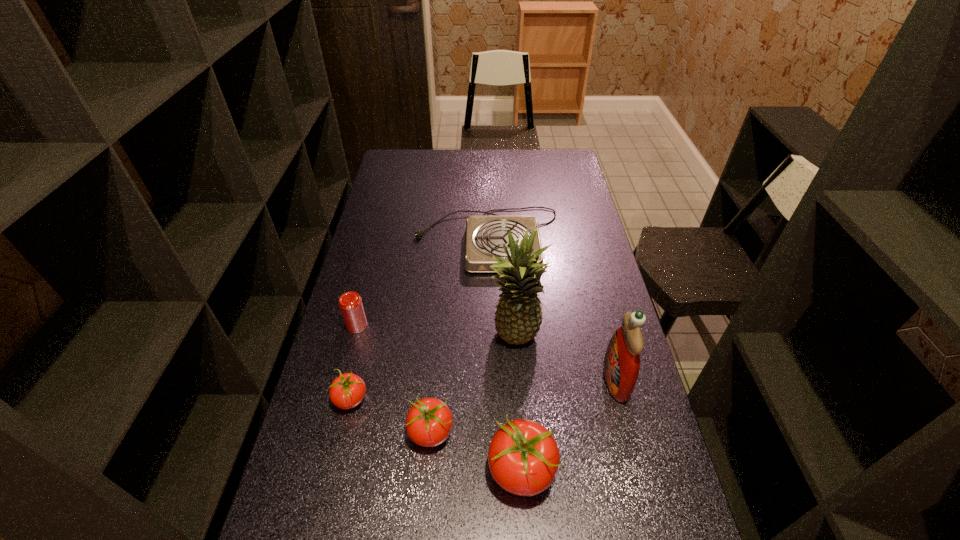
The height and width of the screenshot is (540, 960). In order to click on beer can in this screenshot , I will do `click(350, 303)`.

Identify the location of free space located on the right of the leftmost tomato. This screenshot has width=960, height=540. (486, 399).

Find the location of a particular element. free space located 0.170m on the left of the second tallest tomato is located at coordinates (342, 434).

The height and width of the screenshot is (540, 960). I want to click on free spot located on the left of the third tallest object, so click(372, 472).

Find the location of a particular element. Image resolution: width=960 pixels, height=540 pixels. free space located on the front surface of the rightmost object is located at coordinates (550, 380).

The height and width of the screenshot is (540, 960). I want to click on free space located 0.050m on the front surface of the rightmost object, so click(586, 380).

What are the coordinates of `blank space located on the front surface of the rightmost object` in the screenshot? It's located at (567, 380).

This screenshot has width=960, height=540. In order to click on vacant space situated 0.050m with a retractable cable on the side of the farthest object in this screenshot , I will do `click(489, 290)`.

Where is `free space located on the right of the tallest object`? This screenshot has height=540, width=960. free space located on the right of the tallest object is located at coordinates (580, 338).

Where is `free space located 0.340m on the front of the beer can`? Image resolution: width=960 pixels, height=540 pixels. free space located 0.340m on the front of the beer can is located at coordinates (x=327, y=439).